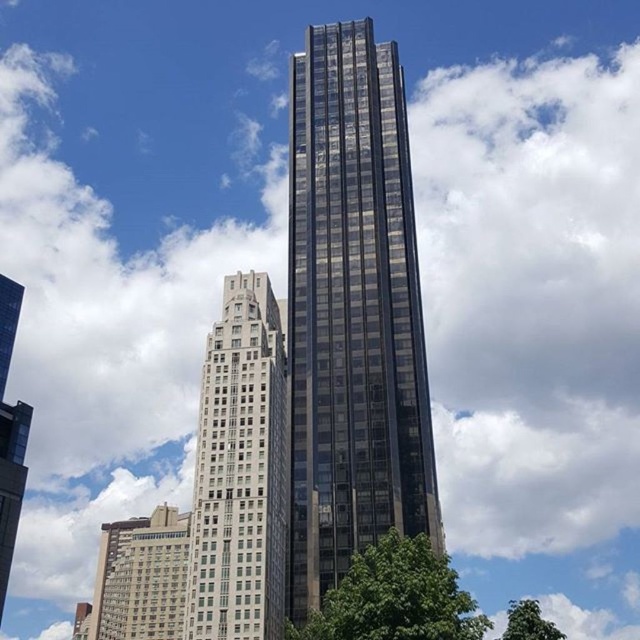
Question: Does green leafy tree at lower center appear under green leafy tree at lower right?

Choices:
 (A) no
 (B) yes

Answer: (A)

Question: Which object is positioned farthest from the white textured building at lower left?

Choices:
 (A) white stone building at center
 (B) green leafy tree at lower right
 (C) green leafy tree at lower center

Answer: (C)

Question: Which of the following is the farthest from the observer?

Choices:
 (A) green leafy tree at lower right
 (B) glassy black skyscraper at center

Answer: (B)

Question: Which point is closer to the camera?

Choices:
 (A) green leafy tree at lower center
 (B) white stone building at center

Answer: (A)

Question: Can you confirm if white stone building at center is positioned above green leafy tree at lower right?

Choices:
 (A) no
 (B) yes

Answer: (B)

Question: Does white textured building at lower left appear on the right side of green leafy tree at lower right?

Choices:
 (A) yes
 (B) no

Answer: (B)